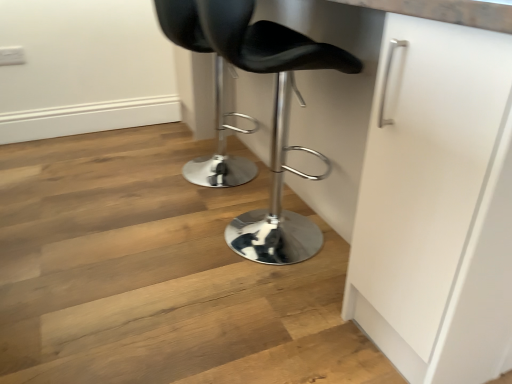
What is the approximate height of black leather stool at center, the 2th chair positioned from the front?

It is 32.45 inches.

The image size is (512, 384). Find the location of `black leather stool at center, the first chair when ordered from back to front`. black leather stool at center, the first chair when ordered from back to front is located at coordinates (221, 148).

What is the approximate width of black leather stool at center, the first chair when ordered from back to front?

The width of black leather stool at center, the first chair when ordered from back to front, is 18.99 inches.

This screenshot has width=512, height=384. What do you see at coordinates (221, 148) in the screenshot?
I see `black leather stool at center, the 2th chair positioned from the front` at bounding box center [221, 148].

What do you see at coordinates (272, 122) in the screenshot? I see `black leather stool at center, the first chair in the front-to-back sequence` at bounding box center [272, 122].

This screenshot has height=384, width=512. In order to click on black leather stool at center, the first chair in the front-to-back sequence in this screenshot , I will do `click(272, 122)`.

Find the location of a particular element. This screenshot has width=512, height=384. black leather stool at center, the 2th chair positioned from the front is located at coordinates (221, 148).

Looking at this image, is black leather stool at center, the first chair in the front-to-back sequence, at the left side of black leather stool at center, the 2th chair positioned from the front?

No.

Is black leather stool at center, which is counted as the 2th chair, starting from the back, closer to the viewer compared to black leather stool at center, the 2th chair positioned from the front?

Yes, black leather stool at center, which is counted as the 2th chair, starting from the back, is in front of black leather stool at center, the 2th chair positioned from the front.

Which is closer, [294,85] or [176,35]?

Point [294,85] is positioned farther from the camera compared to point [176,35].

From the image's perspective, which one is positioned higher, black leather stool at center, the first chair in the front-to-back sequence, or black leather stool at center, the first chair when ordered from back to front?

black leather stool at center, the first chair when ordered from back to front, appears higher in the image.

From a real-world perspective, is black leather stool at center, the first chair in the front-to-back sequence, under black leather stool at center, the first chair when ordered from back to front?

No, from a real-world perspective, black leather stool at center, the first chair in the front-to-back sequence, is not beneath black leather stool at center, the first chair when ordered from back to front.

Does black leather stool at center, which is counted as the 2th chair, starting from the back, have a lesser width compared to black leather stool at center, the first chair when ordered from back to front?

Incorrect, the width of black leather stool at center, which is counted as the 2th chair, starting from the back, is not less than that of black leather stool at center, the first chair when ordered from back to front.

Is black leather stool at center, the first chair in the front-to-back sequence, taller than black leather stool at center, the first chair when ordered from back to front?

Indeed, black leather stool at center, the first chair in the front-to-back sequence, has a greater height compared to black leather stool at center, the first chair when ordered from back to front.

Is black leather stool at center, which is counted as the 2th chair, starting from the back, bigger than black leather stool at center, the 2th chair positioned from the front?

Correct, black leather stool at center, which is counted as the 2th chair, starting from the back, is larger in size than black leather stool at center, the 2th chair positioned from the front.

Is black leather stool at center, the first chair when ordered from back to front, completely or partially inside black leather stool at center, the first chair in the front-to-back sequence?

Actually, black leather stool at center, the first chair when ordered from back to front, is outside black leather stool at center, the first chair in the front-to-back sequence.

Is black leather stool at center, which is counted as the 2th chair, starting from the back, in contact with black leather stool at center, the 2th chair positioned from the front?

black leather stool at center, which is counted as the 2th chair, starting from the back, and black leather stool at center, the 2th chair positioned from the front, are clearly separated.

Looking at this image, is black leather stool at center, which is counted as the 2th chair, starting from the back, looking in the opposite direction of black leather stool at center, the first chair when ordered from back to front?

black leather stool at center, which is counted as the 2th chair, starting from the back, is not turned away from black leather stool at center, the first chair when ordered from back to front.

How many degrees apart are the facing directions of black leather stool at center, which is counted as the 2th chair, starting from the back, and black leather stool at center, the 2th chair positioned from the front?

black leather stool at center, which is counted as the 2th chair, starting from the back, and black leather stool at center, the 2th chair positioned from the front, are facing 0.000263 degrees away from each other.

From the picture: How distant is black leather stool at center, which is counted as the 2th chair, starting from the back, from black leather stool at center, the 2th chair positioned from the front?

A distance of 21.28 inches exists between black leather stool at center, which is counted as the 2th chair, starting from the back, and black leather stool at center, the 2th chair positioned from the front.

Where is `chair below the black leather stool at center, the first chair when ordered from back to front (from the image's perspective)`? This screenshot has height=384, width=512. chair below the black leather stool at center, the first chair when ordered from back to front (from the image's perspective) is located at coordinates (272, 122).

Can you confirm if black leather stool at center, the 2th chair positioned from the front, is positioned to the right of black leather stool at center, the first chair in the front-to-back sequence?

No, black leather stool at center, the 2th chair positioned from the front, is not to the right of black leather stool at center, the first chair in the front-to-back sequence.

In the image, is black leather stool at center, the first chair when ordered from back to front, positioned in front of or behind black leather stool at center, the first chair in the front-to-back sequence?

Visually, black leather stool at center, the first chair when ordered from back to front, is located behind black leather stool at center, the first chair in the front-to-back sequence.

Does point (237, 165) come closer to viewer compared to point (315, 179)?

No, it is not.

From the image's perspective, which one is positioned higher, black leather stool at center, the first chair when ordered from back to front, or black leather stool at center, the first chair in the front-to-back sequence?

black leather stool at center, the first chair when ordered from back to front.

From a real-world perspective, who is located lower, black leather stool at center, the 2th chair positioned from the front, or black leather stool at center, the first chair in the front-to-back sequence?

black leather stool at center, the 2th chair positioned from the front.

Is black leather stool at center, the 2th chair positioned from the front, wider than black leather stool at center, which is counted as the 2th chair, starting from the back?

In fact, black leather stool at center, the 2th chair positioned from the front, might be narrower than black leather stool at center, which is counted as the 2th chair, starting from the back.

Considering the relative sizes of black leather stool at center, the 2th chair positioned from the front, and black leather stool at center, which is counted as the 2th chair, starting from the back, in the image provided, is black leather stool at center, the 2th chair positioned from the front, taller than black leather stool at center, which is counted as the 2th chair, starting from the back,?

Incorrect, the height of black leather stool at center, the 2th chair positioned from the front, is not larger of that of black leather stool at center, which is counted as the 2th chair, starting from the back.

Considering the sizes of objects black leather stool at center, the first chair when ordered from back to front, and black leather stool at center, which is counted as the 2th chair, starting from the back, in the image provided, who is smaller, black leather stool at center, the first chair when ordered from back to front, or black leather stool at center, which is counted as the 2th chair, starting from the back,?

With smaller size is black leather stool at center, the first chair when ordered from back to front.

Is black leather stool at center, the 2th chair positioned from the front, not within black leather stool at center, the first chair in the front-to-back sequence?

That's correct, black leather stool at center, the 2th chair positioned from the front, is outside of black leather stool at center, the first chair in the front-to-back sequence.

Is black leather stool at center, the 2th chair positioned from the front, touching black leather stool at center, which is counted as the 2th chair, starting from the back?

No, black leather stool at center, the 2th chair positioned from the front, is not in contact with black leather stool at center, which is counted as the 2th chair, starting from the back.

Is black leather stool at center, the 2th chair positioned from the front, looking in the opposite direction of black leather stool at center, the first chair in the front-to-back sequence?

black leather stool at center, the 2th chair positioned from the front, is not turned away from black leather stool at center, the first chair in the front-to-back sequence.

How different are the orientations of black leather stool at center, the first chair when ordered from back to front, and black leather stool at center, the first chair in the front-to-back sequence, in degrees?

The facing directions of black leather stool at center, the first chair when ordered from back to front, and black leather stool at center, the first chair in the front-to-back sequence, are 0.000263 degrees apart.

Where is `chair behind the black leather stool at center, the first chair in the front-to-back sequence`? Image resolution: width=512 pixels, height=384 pixels. chair behind the black leather stool at center, the first chair in the front-to-back sequence is located at coordinates (221, 148).

You are a GUI agent. You are given a task and a screenshot of the screen. Output one action in this format:
    pyautogui.click(x=<x>, y=<y>)
    Task: Click on the chair above the black leather stool at center, the first chair in the front-to-back sequence (from the image's perspective)
    This screenshot has width=512, height=384.
    Given the screenshot: What is the action you would take?
    pyautogui.click(x=221, y=148)

Find the location of a particular element. The width and height of the screenshot is (512, 384). chair on the right of the black leather stool at center, the first chair when ordered from back to front is located at coordinates (272, 122).